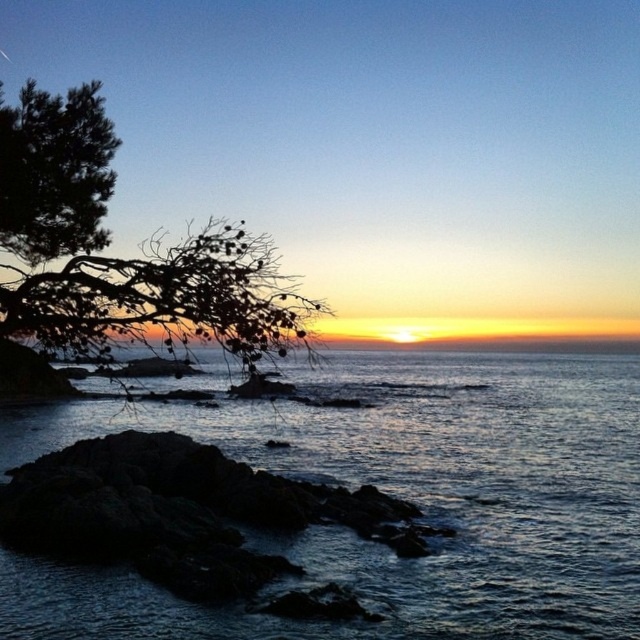
Is dark green leafy tree at left positioned at the back of dark rock at lower left?

No, it is not.

Is point (74, 184) behind point (38, 460)?

No, it is not.

Between point (22, 310) and point (157, 552), which one is positioned in front?

Positioned in front is point (22, 310).

Image resolution: width=640 pixels, height=640 pixels. Identify the location of dark green leafy tree at left. (113, 257).

How far apart are dark blue water at center and dark rock at lower left?

40.96 feet

Is point (589, 477) positioned before point (208, 579)?

That is False.

At what (x,y) coordinates should I click in order to perform the action: click on dark blue water at center. Please return your answer as a coordinate pair (x, y). The height and width of the screenshot is (640, 640). Looking at the image, I should click on (396, 493).

Locate an element on the screen. This screenshot has width=640, height=640. dark blue water at center is located at coordinates (396, 493).

Consider the image. Is dark blue water at center in front of dark green leafy tree at left?

That is False.

Which is below, dark blue water at center or dark green leafy tree at left?

dark blue water at center is lower down.

Locate an element on the screen. The image size is (640, 640). dark blue water at center is located at coordinates (396, 493).

Locate an element on the screen. dark blue water at center is located at coordinates (396, 493).